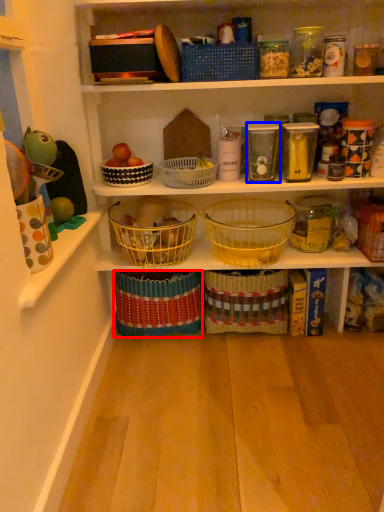
Question: Among these objects, which one is farthest to the camera, basket (highlighted by a red box) or glass jar (highlighted by a blue box)?

Choices:
 (A) basket
 (B) glass jar

Answer: (A)